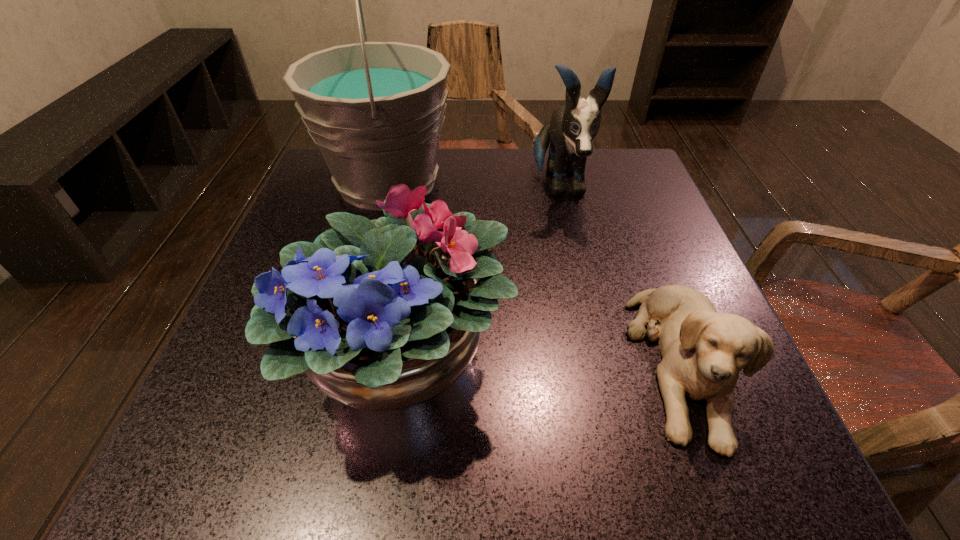
In the image, there is a desktop. Where is `vacant space at the near left corner`? The width and height of the screenshot is (960, 540). vacant space at the near left corner is located at coordinates (190, 473).

In the image, there is a desktop. Where is `free space at the far right corner`? The width and height of the screenshot is (960, 540). free space at the far right corner is located at coordinates (614, 197).

I want to click on vacant space at the near right corner of the desktop, so click(760, 480).

Image resolution: width=960 pixels, height=540 pixels. In order to click on free space between the shorter puppy and the bucket in this screenshot , I will do `click(534, 273)`.

You are a GUI agent. You are given a task and a screenshot of the screen. Output one action in this format:
    pyautogui.click(x=<x>, y=<y>)
    Task: Click on the free space between the tallest object and the taller puppy
    The height and width of the screenshot is (540, 960).
    Given the screenshot: What is the action you would take?
    pyautogui.click(x=473, y=184)

Find the location of `free space between the bucket and the taller puppy`. free space between the bucket and the taller puppy is located at coordinates point(473,184).

The width and height of the screenshot is (960, 540). Find the location of `unoccupied position between the shortest object and the farther puppy`. unoccupied position between the shortest object and the farther puppy is located at coordinates (620, 274).

Identify the location of free space between the tallest object and the taller puppy. The image size is (960, 540). (473, 184).

Where is `free area in between the taller puppy and the tallest object`? This screenshot has height=540, width=960. free area in between the taller puppy and the tallest object is located at coordinates (473, 184).

This screenshot has width=960, height=540. Find the location of `object that ranks as the second closest to the bouquet`. object that ranks as the second closest to the bouquet is located at coordinates (703, 351).